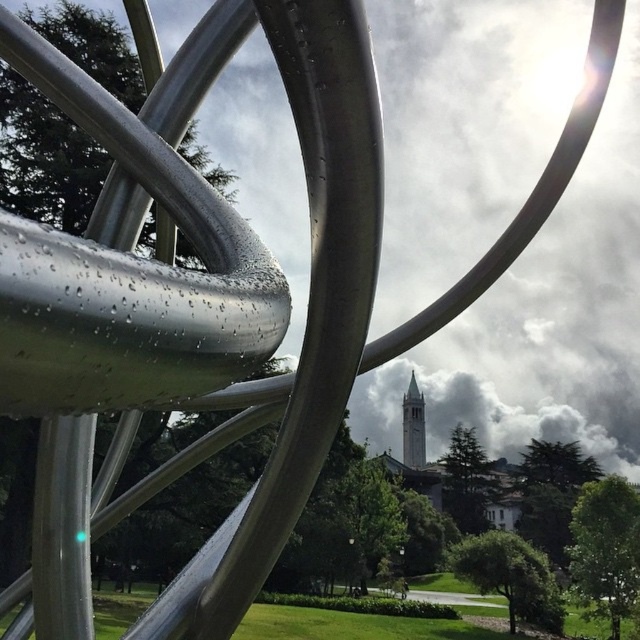
Which of these two, metallic silver sculpture at center or gray stone bell tower at center, stands shorter?

metallic silver sculpture at center

Who is positioned more to the right, metallic silver sculpture at center or gray stone bell tower at center?

gray stone bell tower at center is more to the right.

Where is `metallic silver sculpture at center`? metallic silver sculpture at center is located at coordinates (189, 301).